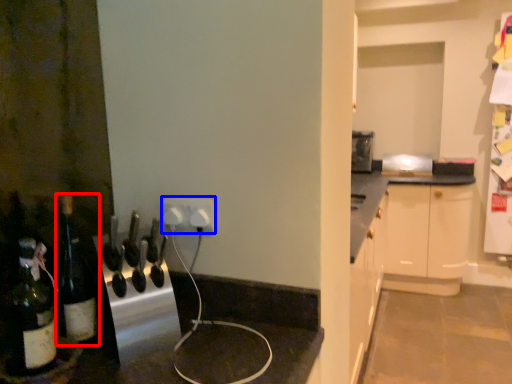
Question: Which object is closer to the camera taking this photo, bottle (highlighted by a red box) or electric outlet (highlighted by a blue box)?

Choices:
 (A) bottle
 (B) electric outlet

Answer: (A)